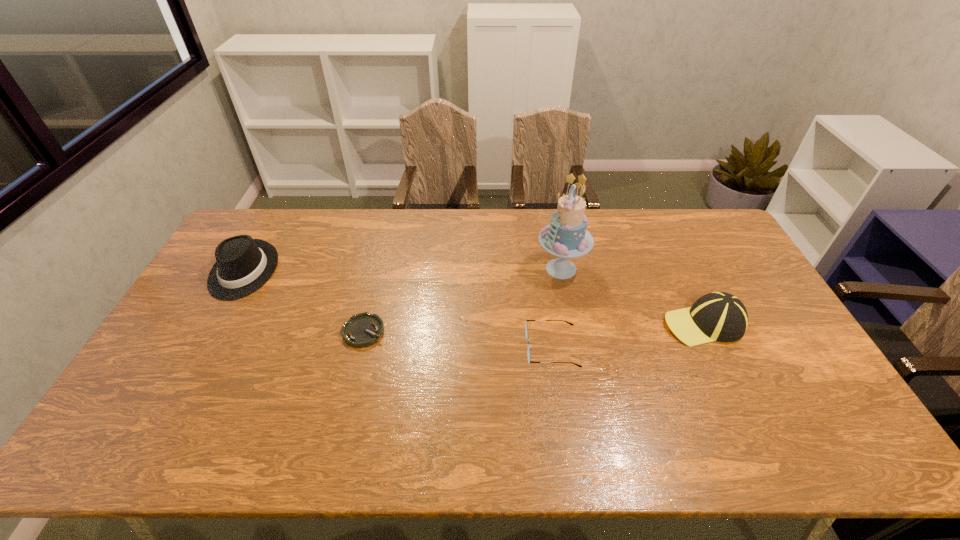
Identify the location of cake. The height and width of the screenshot is (540, 960). (566, 237).

You are a GUI agent. You are given a task and a screenshot of the screen. Output one action in this format:
    pyautogui.click(x=<x>, y=<y>)
    Task: Click on the leftmost object
    The height and width of the screenshot is (540, 960).
    Given the screenshot: What is the action you would take?
    pyautogui.click(x=243, y=265)

At what (x,y) coordinates should I click in order to perform the action: click on baseball cap. Please return your answer as a coordinate pair (x, y). This screenshot has width=960, height=540. Looking at the image, I should click on (718, 316).

The width and height of the screenshot is (960, 540). In order to click on spectacles in this screenshot , I will do `click(526, 329)`.

This screenshot has height=540, width=960. Find the location of `the fourth object from right to left`. the fourth object from right to left is located at coordinates (362, 330).

Find the location of `ashtray`. ashtray is located at coordinates (362, 330).

Find the location of a particular element. blank space located with a ladder on the side of the cake is located at coordinates (446, 269).

In order to click on vacant region located 0.320m with a ladder on the side of the cake in this screenshot , I will do `click(440, 269)`.

You are a GUI agent. You are given a task and a screenshot of the screen. Output one action in this format:
    pyautogui.click(x=<x>, y=<y>)
    Task: Click on the blank space located 0.230m with a ladder on the side of the cake
    The image size is (960, 540).
    Given the screenshot: What is the action you would take?
    pyautogui.click(x=467, y=269)

You are a GUI agent. You are given a task and a screenshot of the screen. Output one action in this format:
    pyautogui.click(x=<x>, y=<y>)
    Task: Click on the vacant space located 0.050m on the front-facing side of the leftmost object
    This screenshot has height=540, width=960.
    Given the screenshot: What is the action you would take?
    pyautogui.click(x=220, y=313)